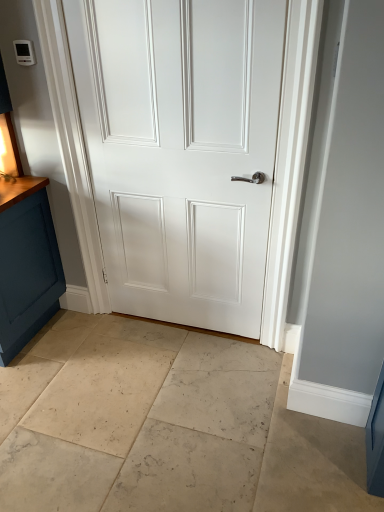
Image resolution: width=384 pixels, height=512 pixels. Find the location of `beige marble floor at center`. beige marble floor at center is located at coordinates (165, 426).

What do you see at coordinates (165, 426) in the screenshot? I see `beige marble floor at center` at bounding box center [165, 426].

This screenshot has height=512, width=384. Describe the element at coordinates (181, 151) in the screenshot. I see `white matte door at center` at that location.

Find the location of `white matte door at center`. white matte door at center is located at coordinates (181, 151).

At what (x,y) coordinates should I click in order to perform the action: click on beige marble floor at center. Please return your answer as a coordinate pair (x, y). Looking at the image, I should click on (165, 426).

Would you say beige marble floor at center is to the left or to the right of white matte door at center in the picture?

Based on their positions, beige marble floor at center is located to the left of white matte door at center.

Which is in front, beige marble floor at center or white matte door at center?

beige marble floor at center is in front.

Does point (340, 437) appear closer or farther from the camera than point (133, 116)?

Point (340, 437) appears to be closer to the viewer than point (133, 116).

From the image's perspective, is beige marble floor at center beneath white matte door at center?

Yes, from the image's perspective, beige marble floor at center is below white matte door at center.

From a real-world perspective, which object stands above the other?

In real-world perspective, white matte door at center is above.

Considering the relative sizes of beige marble floor at center and white matte door at center in the image provided, is beige marble floor at center thinner than white matte door at center?

Incorrect, the width of beige marble floor at center is not less than that of white matte door at center.

Which of these two, beige marble floor at center or white matte door at center, stands shorter?

Standing shorter between the two is beige marble floor at center.

Which of these two, beige marble floor at center or white matte door at center, is smaller?

With smaller size is white matte door at center.

Is beige marble floor at center outside of white matte door at center?

That's correct, beige marble floor at center is outside of white matte door at center.

Are beige marble floor at center and white matte door at center making contact?

No, beige marble floor at center is not with white matte door at center.

Could you tell me if beige marble floor at center is facing white matte door at center?

No, beige marble floor at center is not facing towards white matte door at center.

At what (x,y) coordinates should I click in order to perform the action: click on door above the beige marble floor at center (from a real-world perspective). Please return your answer as a coordinate pair (x, y). Image resolution: width=384 pixels, height=512 pixels. Looking at the image, I should click on (181, 151).

Which is more to the right, white matte door at center or beige marble floor at center?

Positioned to the right is white matte door at center.

Is white matte door at center further to the viewer compared to beige marble floor at center?

Yes, the depth of white matte door at center is greater than that of beige marble floor at center.

Is point (171, 115) closer to viewer compared to point (344, 485)?

No, (171, 115) is further to viewer.

From the image's perspective, which is above, white matte door at center or beige marble floor at center?

white matte door at center.

From a real-world perspective, who is located lower, white matte door at center or beige marble floor at center?

In real-world perspective, beige marble floor at center is lower.

Considering the relative sizes of white matte door at center and beige marble floor at center in the image provided, is white matte door at center wider than beige marble floor at center?

No.

Which of these two, white matte door at center or beige marble floor at center, stands taller?

white matte door at center is taller.

Between white matte door at center and beige marble floor at center, which one has smaller size?

white matte door at center is smaller.

Consider the image. Is white matte door at center surrounding beige marble floor at center?

Actually, beige marble floor at center is outside white matte door at center.

Are white matte door at center and beige marble floor at center located far from each other?

Actually, white matte door at center and beige marble floor at center are a little close together.

Could you tell me if white matte door at center is turned towards beige marble floor at center?

Yes, white matte door at center faces towards beige marble floor at center.

Looking at this image, how far apart are white matte door at center and beige marble floor at center?

Result: The distance of white matte door at center from beige marble floor at center is 31.82 inches.

At what (x,y) coordinates should I click in order to perform the action: click on door located behind the beige marble floor at center. Please return your answer as a coordinate pair (x, y). The height and width of the screenshot is (512, 384). Looking at the image, I should click on (181, 151).

What are the coordinates of `concrete that appears in front of the white matte door at center` in the screenshot? It's located at (165, 426).

The height and width of the screenshot is (512, 384). There is a beige marble floor at center. In order to click on door above it (from a real-world perspective) in this screenshot , I will do `click(181, 151)`.